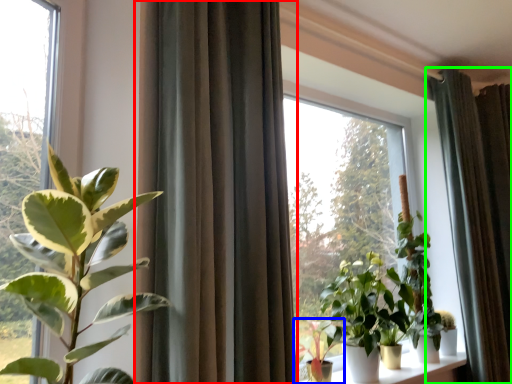
Question: Which is farther away from curtain (highlighted by a red box)? houseplant (highlighted by a blue box) or curtain (highlighted by a green box)?

Choices:
 (A) houseplant
 (B) curtain

Answer: (B)